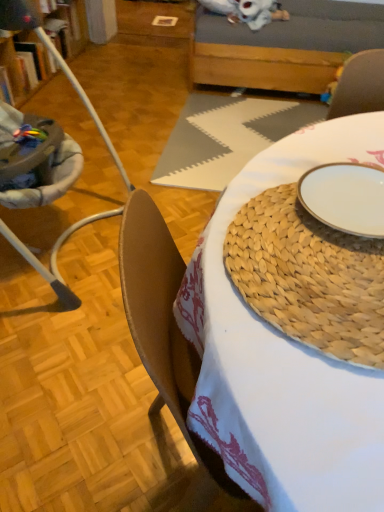
Question: Is white ceramic plate at center taller or shorter than brown leather chair at left?

Choices:
 (A) tall
 (B) short

Answer: (B)

Question: From a real-world perspective, relative to brown leather chair at left, is white ceramic plate at center vertically above or below?

Choices:
 (A) above
 (B) below

Answer: (A)

Question: Which of these objects is positioned farthest from the woven mat at center?

Choices:
 (A) velvet-like gray armchair at upper right
 (B) white woven placemat at center
 (C) white ceramic plate at center
 (D) brown leather chair at left
 (E) natural woven placemat at center

Answer: (B)

Question: Considering the real-world distances, which object is farthest from the white ceramic plate at center?

Choices:
 (A) white woven placemat at center
 (B) natural woven placemat at center
 (C) wooden couch at upper center
 (D) woven mat at center
 (E) velvet-like gray armchair at upper right

Answer: (C)